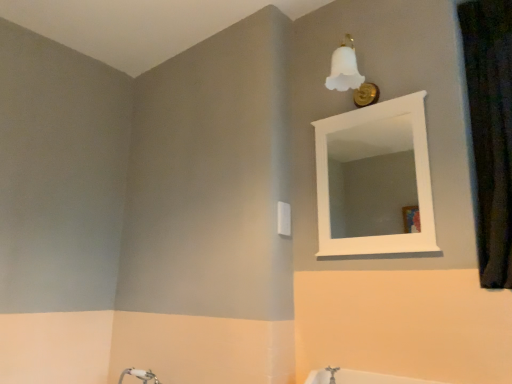
Question: From the image's perspective, is black textured curtain at right located above or below white wooden mirror at upper center?

Choices:
 (A) above
 (B) below

Answer: (A)

Question: From a real-world perspective, is black textured curtain at right above or below white wooden mirror at upper center?

Choices:
 (A) below
 (B) above

Answer: (B)

Question: Does point (488, 115) appear closer or farther from the camera than point (381, 160)?

Choices:
 (A) farther
 (B) closer

Answer: (B)

Question: In the image, is white wooden mirror at upper center on the left side or the right side of black textured curtain at right?

Choices:
 (A) right
 (B) left

Answer: (B)

Question: From the image's perspective, relative to black textured curtain at right, is white wooden mirror at upper center above or below?

Choices:
 (A) above
 (B) below

Answer: (B)

Question: Considering their positions, is white wooden mirror at upper center located in front of or behind black textured curtain at right?

Choices:
 (A) front
 (B) behind

Answer: (B)

Question: From a real-world perspective, relative to black textured curtain at right, is white wooden mirror at upper center vertically above or below?

Choices:
 (A) above
 (B) below

Answer: (B)